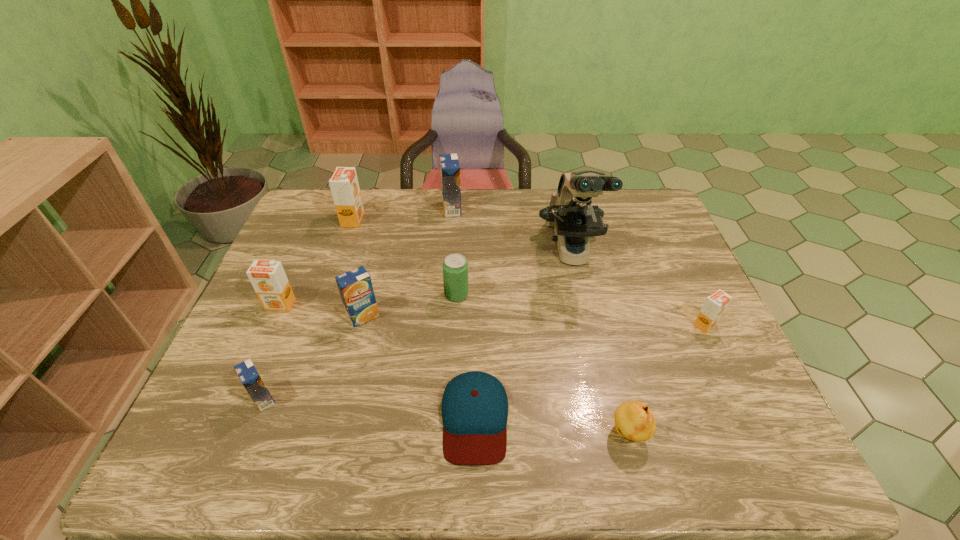
This screenshot has height=540, width=960. Find the location of `the nearest orange juice`. the nearest orange juice is located at coordinates (248, 374).

In order to click on the nearest blue orange_juice in this screenshot , I will do `click(248, 374)`.

This screenshot has width=960, height=540. What are the coordinates of `the smallest orange orange juice` in the screenshot? It's located at (715, 305).

Where is `the rightmost object`? the rightmost object is located at coordinates (715, 305).

You are a GUI agent. You are given a task and a screenshot of the screen. Output one action in this format:
    pyautogui.click(x=<x>, y=<y>)
    Task: Click on the pear
    
    Given the screenshot: What is the action you would take?
    pyautogui.click(x=634, y=420)

The width and height of the screenshot is (960, 540). I want to click on the shortest object, so click(x=474, y=408).

The height and width of the screenshot is (540, 960). In order to click on vacant position located 0.090m through the eyepieces of the tallest object in this screenshot , I will do `click(586, 311)`.

Find the location of `vacant area situated on the front of the farthest blue orange_juice`. vacant area situated on the front of the farthest blue orange_juice is located at coordinates (444, 301).

Identify the location of vacant region located on the front of the second orange orange juice from right to left. Image resolution: width=960 pixels, height=540 pixels. (320, 315).

Locate an element on the screen. This screenshot has width=960, height=540. vacant space situated 0.360m on the front of the fourth orange juice from left to right is located at coordinates (324, 471).